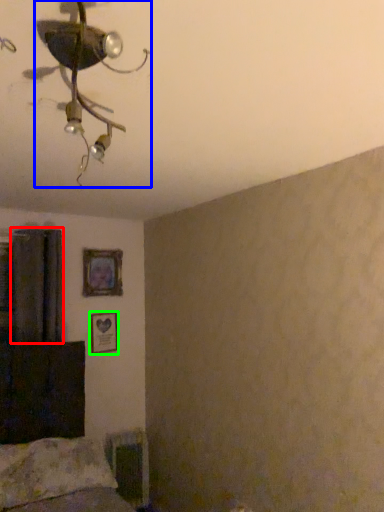
Question: Based on their relative distances, which object is nearer to curtain (highlighted by a red box)? Choose from lamp (highlighted by a blue box) and picture frame (highlighted by a green box).

Choices:
 (A) lamp
 (B) picture frame

Answer: (B)